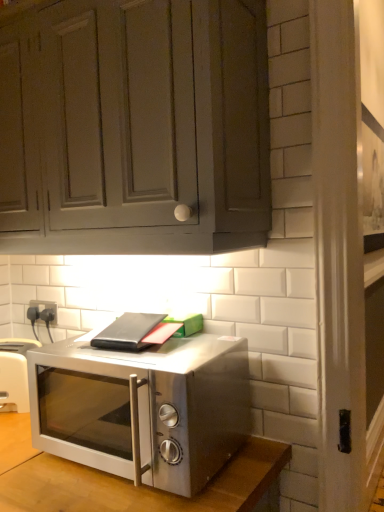
The image size is (384, 512). I want to click on satin silver toaster at lower left, so click(x=14, y=374).

The height and width of the screenshot is (512, 384). I want to click on satin silver toaster at lower left, so click(x=14, y=374).

Would you say satin silver microwave at center is a long distance from satin silver toaster at lower left?

satin silver microwave at center is actually quite close to satin silver toaster at lower left.

From a real-world perspective, is satin silver microwave at center physically located above or below satin silver toaster at lower left?

satin silver microwave at center is situated higher than satin silver toaster at lower left in the real world.

Is satin silver microwave at center to the left of satin silver toaster at lower left from the viewer's perspective?

No, satin silver microwave at center is not to the left of satin silver toaster at lower left.

How different are the orientations of satin silver microwave at center and satin silver toaster at lower left in degrees?

32.7 degrees.

Based on the photo, are satin silver microwave at center and matte gray cabinet at upper center located far from each other?

No, there isn't a large distance between satin silver microwave at center and matte gray cabinet at upper center.

Consider the image. Do you think satin silver microwave at center is within matte gray cabinet at upper center, or outside of it?

satin silver microwave at center exists outside the volume of matte gray cabinet at upper center.

Measure the distance between satin silver microwave at center and matte gray cabinet at upper center.

satin silver microwave at center is 18.50 inches from matte gray cabinet at upper center.

Can you confirm if satin silver microwave at center is thinner than matte gray cabinet at upper center?

No, satin silver microwave at center is not thinner than matte gray cabinet at upper center.

Who is smaller, matte gray cabinet at upper center or satin silver toaster at lower left?

Smaller between the two is satin silver toaster at lower left.

Based on the photo, could satin silver toaster at lower left be considered to be inside matte gray cabinet at upper center?

No, matte gray cabinet at upper center does not contain satin silver toaster at lower left.

From the image's perspective, is matte gray cabinet at upper center positioned above or below satin silver toaster at lower left?

Clearly, from the image's perspective, matte gray cabinet at upper center is above satin silver toaster at lower left.

Is satin silver toaster at lower left at the back of matte gray cabinet at upper center?

No, matte gray cabinet at upper center is not facing away from satin silver toaster at lower left.

Considering the relative sizes of satin silver toaster at lower left and satin silver microwave at center in the image provided, is satin silver toaster at lower left thinner than satin silver microwave at center?

Indeed, satin silver toaster at lower left has a lesser width compared to satin silver microwave at center.

Does point (7, 372) lie in front of point (48, 446)?

No, (7, 372) is behind (48, 446).

What's the angular difference between satin silver toaster at lower left and satin silver microwave at center's facing directions?

There is a 32.7-degree angle between the facing directions of satin silver toaster at lower left and satin silver microwave at center.

Does matte gray cabinet at upper center appear on the left side of satin silver microwave at center?

Yes.

Would you say matte gray cabinet at upper center is a long distance from satin silver microwave at center?

No.

Would you say satin silver microwave at center is part of matte gray cabinet at upper center's contents?

No, satin silver microwave at center is not a part of matte gray cabinet at upper center.

Is matte gray cabinet at upper center oriented away from satin silver microwave at center?

No, satin silver microwave at center is not at the back of matte gray cabinet at upper center.

From the picture: Does satin silver toaster at lower left come in front of matte gray cabinet at upper center?

No, satin silver toaster at lower left is further to the viewer.

Is satin silver toaster at lower left facing away from matte gray cabinet at upper center?

satin silver toaster at lower left does not have its back to matte gray cabinet at upper center.

Does satin silver toaster at lower left have a larger size compared to matte gray cabinet at upper center?

Incorrect, satin silver toaster at lower left is not larger than matte gray cabinet at upper center.

Can you confirm if satin silver toaster at lower left is thinner than matte gray cabinet at upper center?

Correct, the width of satin silver toaster at lower left is less than that of matte gray cabinet at upper center.

Find the location of `microwave oven located above the satin silver toaster at lower left (from a real-world perspective)`. microwave oven located above the satin silver toaster at lower left (from a real-world perspective) is located at coordinates (144, 407).

Find the location of `microwave oven located behind the matte gray cabinet at upper center`. microwave oven located behind the matte gray cabinet at upper center is located at coordinates (144, 407).

Looking at the image, which one is located closer to satin silver toaster at lower left, satin silver microwave at center or matte gray cabinet at upper center?

satin silver microwave at center.

From the image, which object appears to be nearer to satin silver microwave at center, satin silver toaster at lower left or matte gray cabinet at upper center?

Based on the image, satin silver toaster at lower left appears to be nearer to satin silver microwave at center.

When comparing their distances from matte gray cabinet at upper center, does satin silver toaster at lower left or satin silver microwave at center seem closer?

satin silver microwave at center.

Considering their positions, is matte gray cabinet at upper center positioned further to satin silver microwave at center than satin silver toaster at lower left?

matte gray cabinet at upper center is further to satin silver microwave at center.

From the image, which object appears to be farther from satin silver toaster at lower left, matte gray cabinet at upper center or satin silver microwave at center?

Among the two, matte gray cabinet at upper center is located further to satin silver toaster at lower left.

Which object lies further to the anchor point matte gray cabinet at upper center, satin silver microwave at center or satin silver toaster at lower left?

Based on the image, satin silver toaster at lower left appears to be further to matte gray cabinet at upper center.

Where is `microwave oven between matte gray cabinet at upper center and satin silver toaster at lower left vertically`? This screenshot has height=512, width=384. microwave oven between matte gray cabinet at upper center and satin silver toaster at lower left vertically is located at coordinates (144, 407).